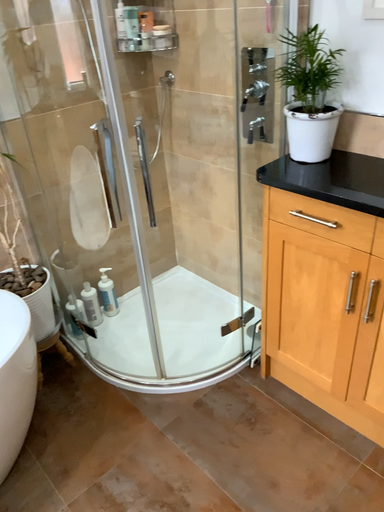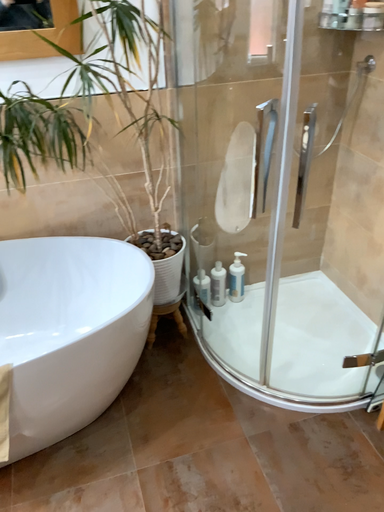
Question: How did the camera likely rotate when shooting the video?

Choices:
 (A) rotated left
 (B) rotated right

Answer: (A)